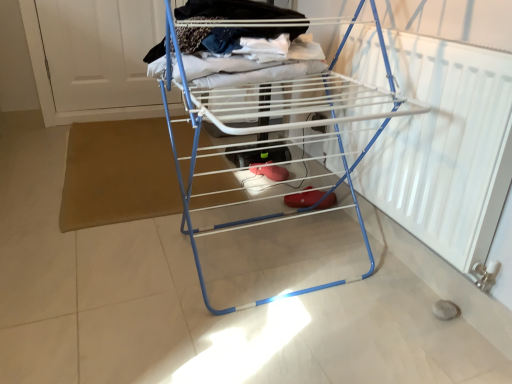
Question: From a real-world perspective, is blue metal drying rack at center positioned over white matte door at upper left based on gravity?

Choices:
 (A) no
 (B) yes

Answer: (B)

Question: Is blue metal drying rack at center outside white matte door at upper left?

Choices:
 (A) no
 (B) yes

Answer: (B)

Question: Is blue metal drying rack at center shorter than white matte door at upper left?

Choices:
 (A) no
 (B) yes

Answer: (A)

Question: Is blue metal drying rack at center facing towards white matte door at upper left?

Choices:
 (A) no
 (B) yes

Answer: (A)

Question: Is blue metal drying rack at center taller than white matte door at upper left?

Choices:
 (A) no
 (B) yes

Answer: (B)

Question: Can you confirm if blue metal drying rack at center is bigger than white matte door at upper left?

Choices:
 (A) no
 (B) yes

Answer: (B)

Question: Can we say white matte door at upper left lies outside blue metal drying rack at center?

Choices:
 (A) yes
 (B) no

Answer: (A)

Question: From the image's perspective, does white matte door at upper left appear lower than blue metal drying rack at center?

Choices:
 (A) no
 (B) yes

Answer: (A)

Question: Is blue metal drying rack at center at the back of white matte door at upper left?

Choices:
 (A) no
 (B) yes

Answer: (A)

Question: Does white matte door at upper left have a greater width compared to blue metal drying rack at center?

Choices:
 (A) yes
 (B) no

Answer: (B)

Question: Is white matte door at upper left behind blue metal drying rack at center?

Choices:
 (A) yes
 (B) no

Answer: (A)

Question: Is white matte door at upper left to the left of blue metal drying rack at center from the viewer's perspective?

Choices:
 (A) yes
 (B) no

Answer: (A)

Question: From a real-world perspective, is blue metal drying rack at center positioned above or below white matte door at upper left?

Choices:
 (A) above
 (B) below

Answer: (A)